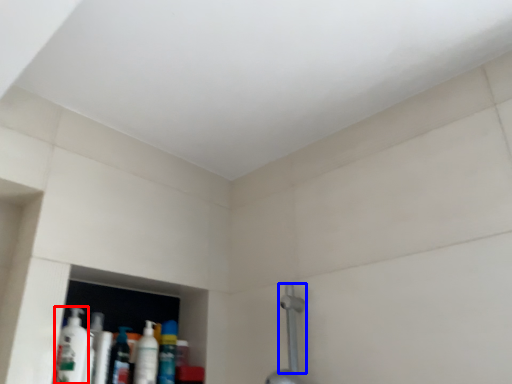
Question: Which object is further to the camera taking this photo, mouthwash (highlighted by a red box) or shower (highlighted by a blue box)?

Choices:
 (A) mouthwash
 (B) shower

Answer: (B)